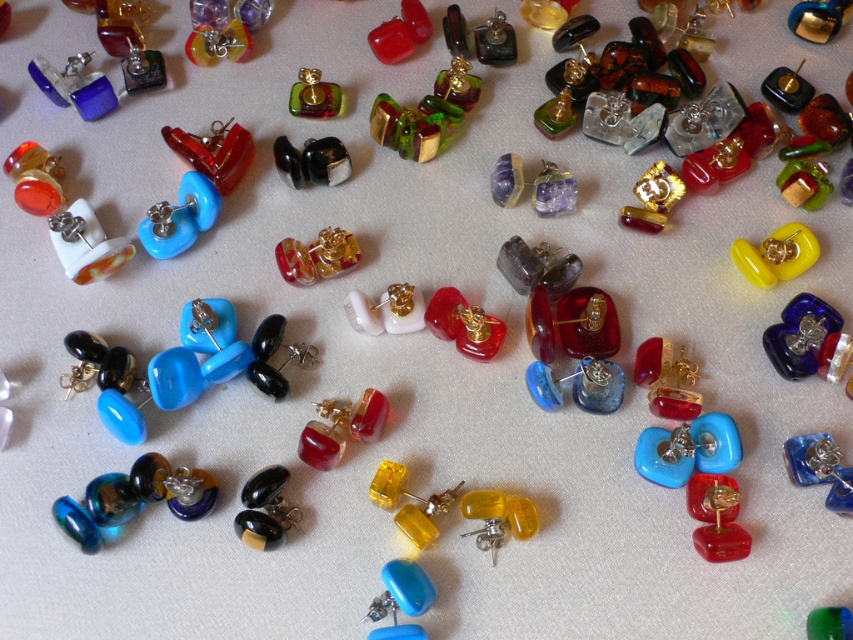
Who is shorter, glossy red stone at center or matte red glass earring at center?

matte red glass earring at center is shorter.

Is glossy red stone at center to the right of matte red glass earring at center from the viewer's perspective?

No, glossy red stone at center is not to the right of matte red glass earring at center.

Measure the distance between point (352, 420) and camera.

1.25 meters

Where is `glossy red stone at center`? The width and height of the screenshot is (853, 640). glossy red stone at center is located at coordinates (341, 428).

The image size is (853, 640). What do you see at coordinates (265, 509) in the screenshot?
I see `black glossy earrings at center` at bounding box center [265, 509].

Measure the distance between black glossy earrings at center and camera.

3.87 feet

I want to click on black glossy earrings at center, so click(x=265, y=509).

Is the position of glossy red stone at center less distant than that of black glossy earrings at center?

No, it is not.

Who is more distant from viewer, (328,456) or (264,488)?

Point (328,456)

Locate an element on the screen. glossy red stone at center is located at coordinates (341, 428).